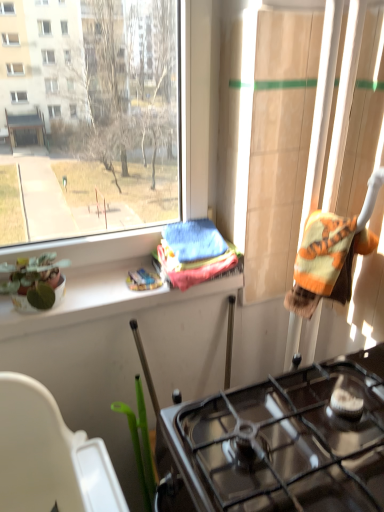
You are a GUI agent. You are given a task and a screenshot of the screen. Output one action in this format:
    pyautogui.click(x=<x>, y=<y>)
    Task: Click on the blank area beneath transparent glass window at center (from a real-world perspective)
    This screenshot has width=384, height=512.
    Given the screenshot: What is the action you would take?
    pyautogui.click(x=100, y=272)